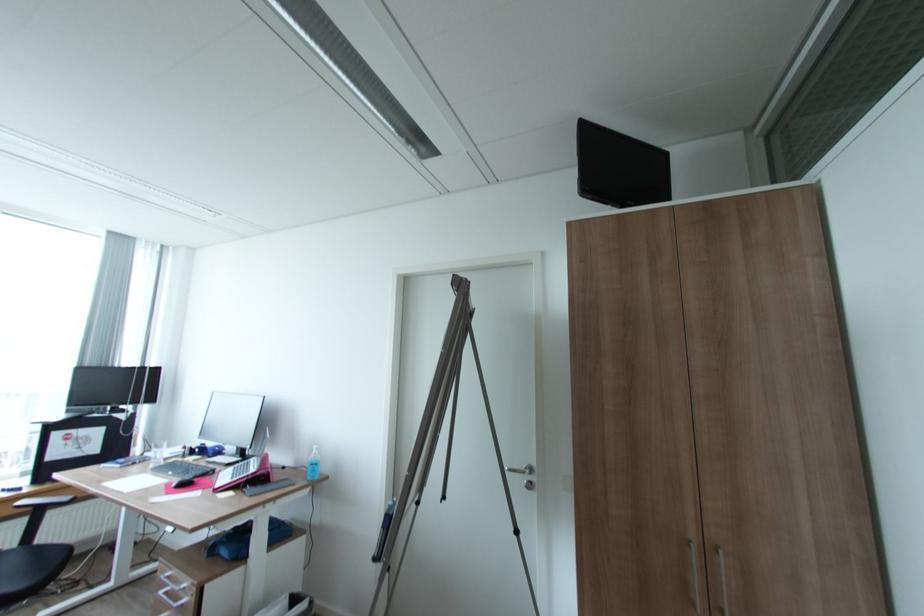
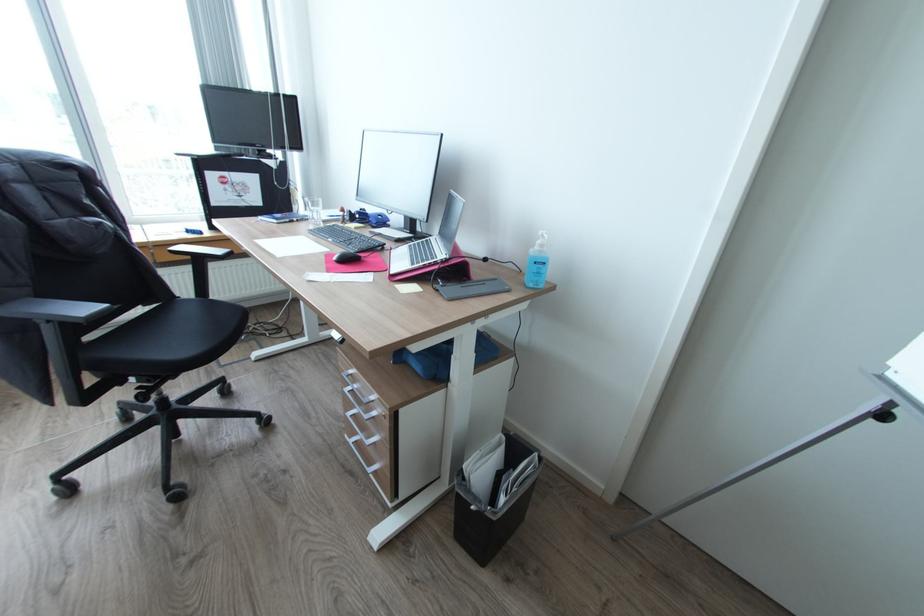
The point at (175, 573) is marked in the first image. Where is the corresponding point in the second image?

(357, 371)